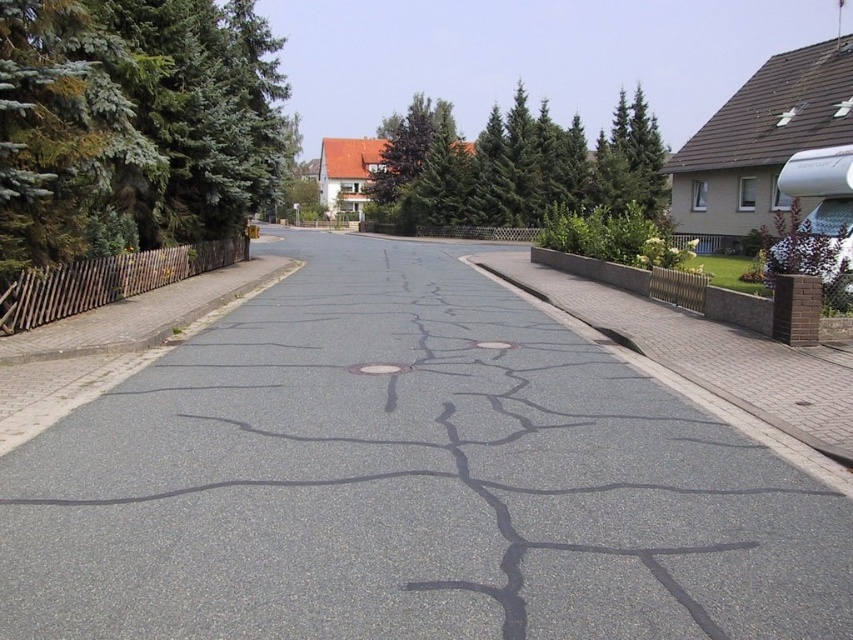
You are standing at the center of the residential street and want to find the green textured pine tree at left. According to the scene description, where should you look relative to your position?

The green textured pine tree at left is located at point 0.192 on the x axis and 0.156 on the y axis relative to the image frame, so you should look towards the lower left direction from your current position at the center of the street.

You are a surveyor measuring the height of objects in the scene. Which object is shorter between the gray asphalt road at center and the green textured pine tree at left?

The gray asphalt road at center has a lesser height compared to the green textured pine tree at left, so the gray asphalt road at center is shorter.